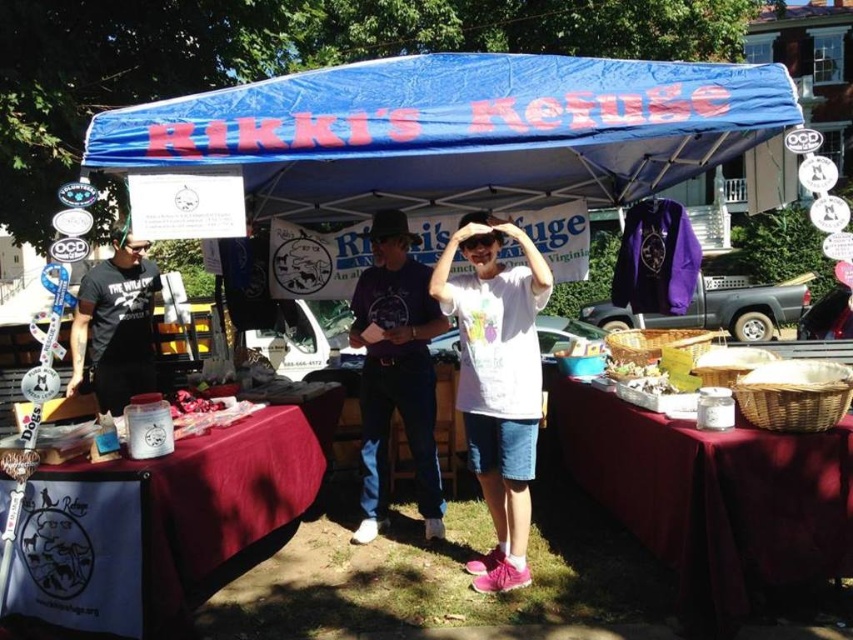
I want to click on white fabric table at lower left, so click(x=157, y=525).

Who is more forward, (54,616) or (122,262)?

Point (54,616)

Between point (91, 582) and point (148, 305), which one is positioned in front?

Positioned in front is point (91, 582).

Where is `white fabric table at lower left`? white fabric table at lower left is located at coordinates (157, 525).

Between woven baskets at lower right and denim jeans at center, which one has less height?

With less height is woven baskets at lower right.

Between woven baskets at lower right and denim jeans at center, which one appears on the right side from the viewer's perspective?

Positioned to the right is woven baskets at lower right.

The height and width of the screenshot is (640, 853). Describe the element at coordinates (711, 499) in the screenshot. I see `woven baskets at lower right` at that location.

Image resolution: width=853 pixels, height=640 pixels. I want to click on woven baskets at lower right, so click(711, 499).

Which of these two, blue fabric canopy at upper center or white cotton t-shirt at center, stands shorter?

Standing shorter between the two is blue fabric canopy at upper center.

Who is more distant from viewer, (x=172, y=124) or (x=509, y=486)?

Point (x=509, y=486)

Is point (701, 122) farther from viewer compared to point (506, 556)?

That is False.

Where is `blue fabric canopy at upper center`? The height and width of the screenshot is (640, 853). blue fabric canopy at upper center is located at coordinates (456, 131).